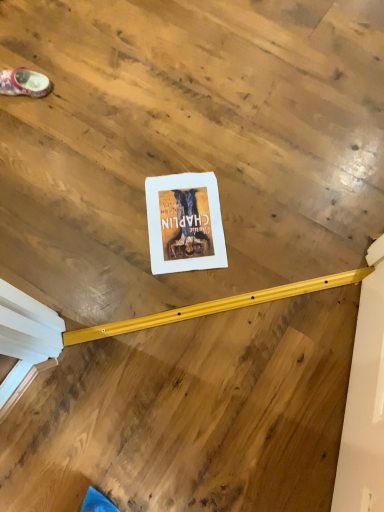
At what (x,y) coordinates should I click in order to perform the action: click on vacant area that is in front of matte pink fabric slipper at upper left. Please return your answer as a coordinate pair (x, y). This screenshot has width=384, height=512. Looking at the image, I should click on (30, 129).